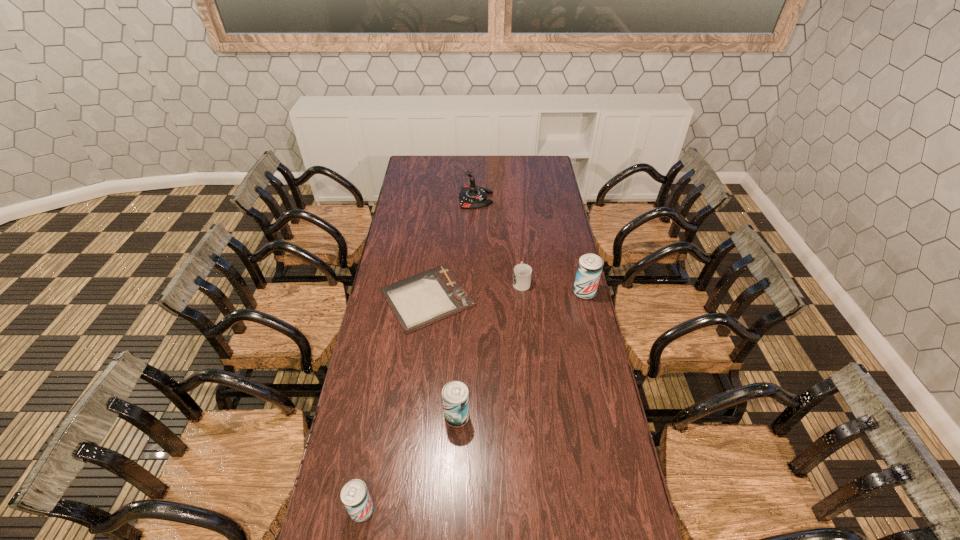
What are the coordinates of `the closest beer can to the cup` in the screenshot? It's located at (589, 269).

Identify which beer can is the nearest to the clipboard. Please provide its 2D coordinates. Your answer should be formatted as a tuple, i.e. [(x, y)], where the tuple contains the x and y coordinates of a point satisfying the conditions above.

[(455, 394)]

Locate an element on the screen. free location that satisfies the following two spatial constraints: 1. on the back side of the nearest beer can; 2. on the left side of the shortest object is located at coordinates (400, 298).

Locate an element on the screen. The image size is (960, 540). vacant space that satisfies the following two spatial constraints: 1. on the handle side of the joystick; 2. on the right side of the farthest beer can is located at coordinates (474, 292).

You are a GUI agent. You are given a task and a screenshot of the screen. Output one action in this format:
    pyautogui.click(x=<x>, y=<y>)
    Task: Click on the vacant point that satisfies the following two spatial constraints: 1. on the handle side of the joystick; 2. on the side of the second object from right to left where the handle is located
    
    Given the screenshot: What is the action you would take?
    pyautogui.click(x=474, y=282)

Locate an element on the screen. This screenshot has height=540, width=960. free space that satisfies the following two spatial constraints: 1. on the handle side of the joystick; 2. on the front side of the second shortest beer can is located at coordinates (473, 417).